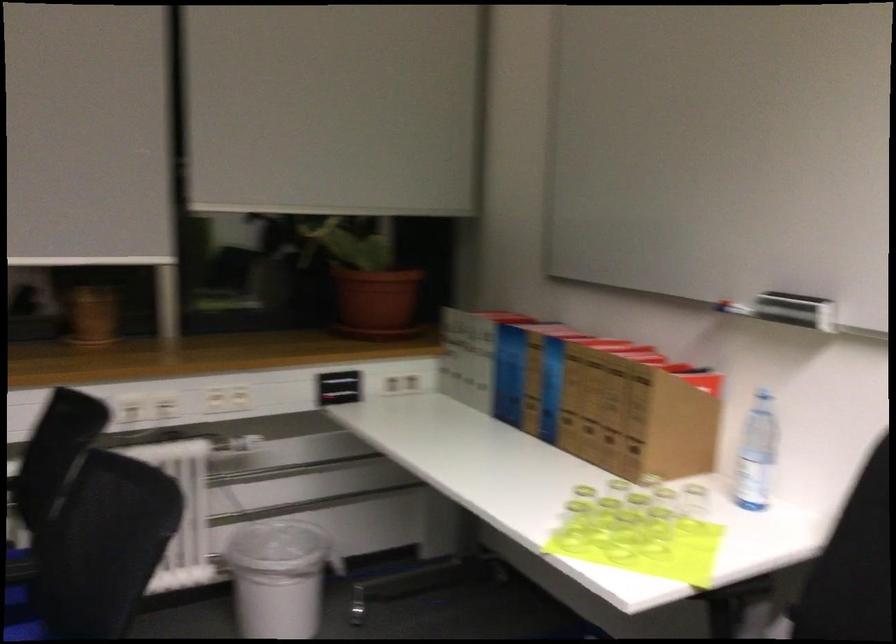
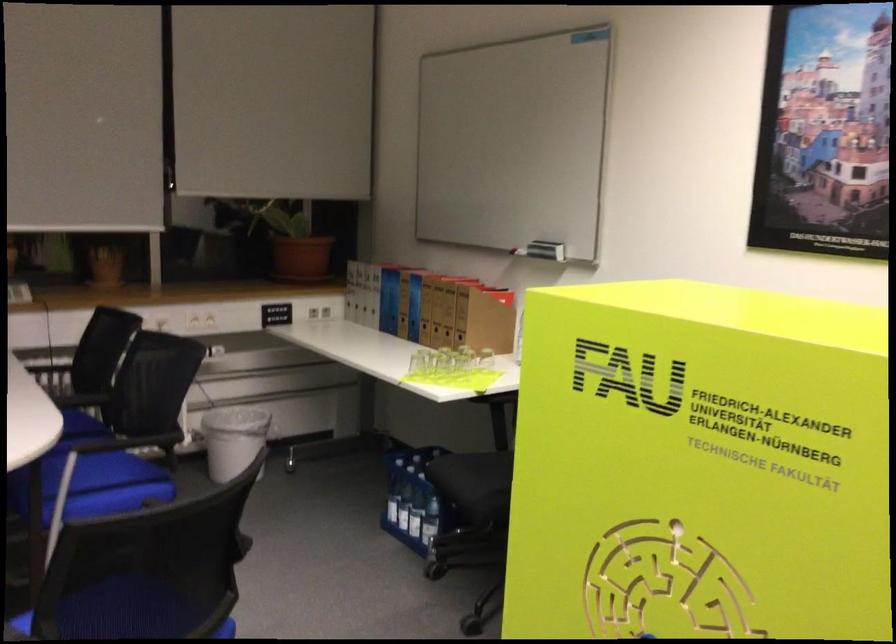
The point at [791,316] is marked in the first image. Where is the corresponding point in the second image?

(546, 250)